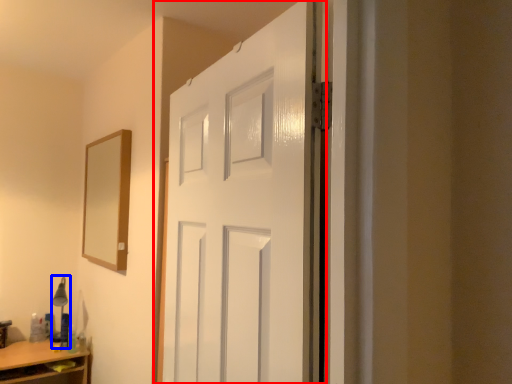
Question: Which of the following is the closest to the observer, door (highlighted by a red box) or table lamp (highlighted by a blue box)?

Choices:
 (A) door
 (B) table lamp

Answer: (A)